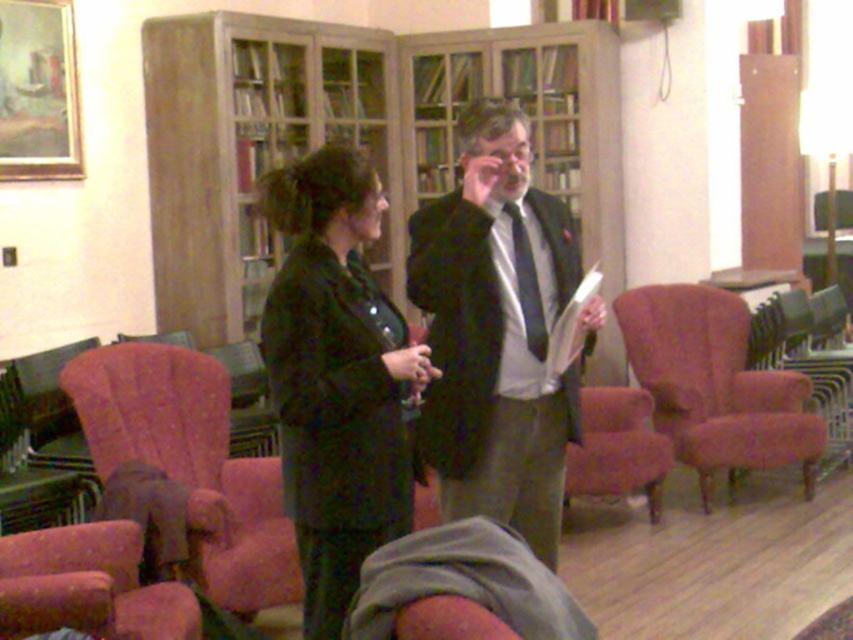
Looking at this image, is matte black jacket at center wider than velvet pink armchair at center?

Incorrect, matte black jacket at center's width does not surpass velvet pink armchair at center's.

Can you confirm if matte black jacket at center is smaller than velvet pink armchair at center?

No.

Where is `matte black jacket at center`? Image resolution: width=853 pixels, height=640 pixels. matte black jacket at center is located at coordinates (337, 378).

Looking at this image, who is higher up, velvet pink armchair at left or velvet pink armchair at right?

velvet pink armchair at right

Is velvet pink armchair at left below velvet pink armchair at right?

Indeed, velvet pink armchair at left is positioned under velvet pink armchair at right.

Where is `velvet pink armchair at left`? The height and width of the screenshot is (640, 853). velvet pink armchair at left is located at coordinates (190, 461).

This screenshot has width=853, height=640. Find the location of `velvet pink armchair at left`. velvet pink armchair at left is located at coordinates (190, 461).

Can you confirm if matte black suit at center is smaller than velvet pink armchair at right?

Correct, matte black suit at center occupies less space than velvet pink armchair at right.

Is matte black suit at center to the right of velvet pink armchair at right from the viewer's perspective?

In fact, matte black suit at center is to the left of velvet pink armchair at right.

Does point (476, 476) lie in front of point (697, 385)?

Yes, it is in front of point (697, 385).

Image resolution: width=853 pixels, height=640 pixels. Identify the location of matte black suit at center. (496, 332).